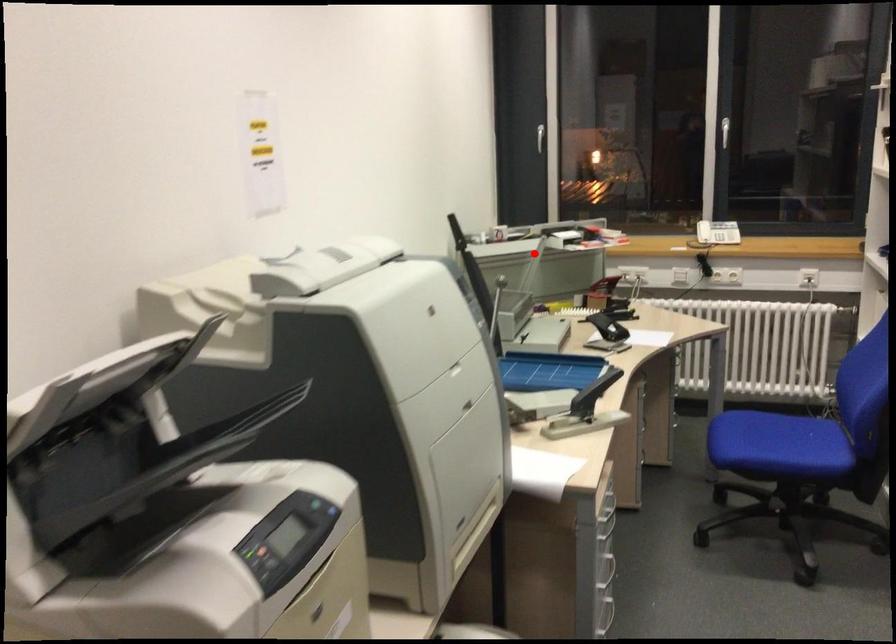
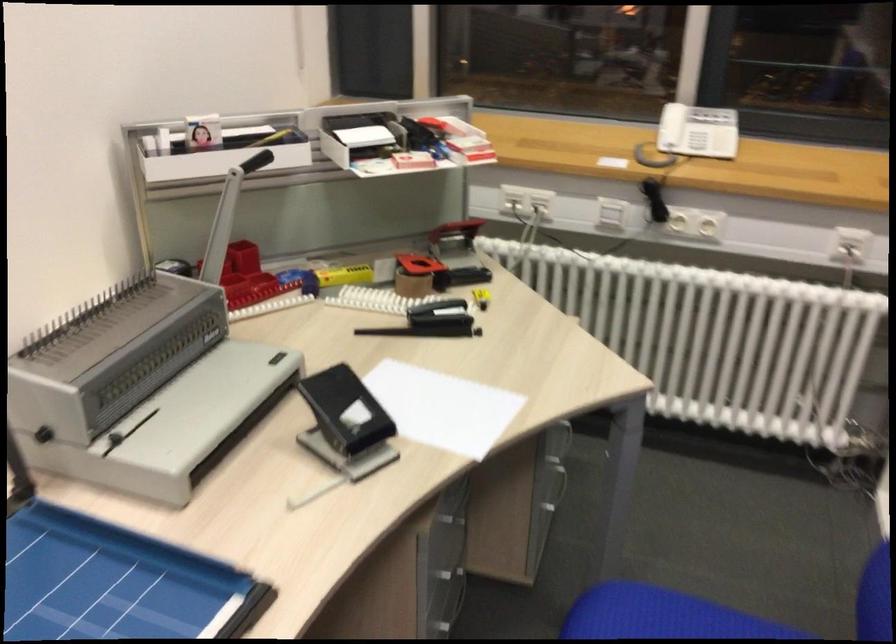
Where in the second image is the point corresponding to the highlighted location from the first image?

(228, 216)